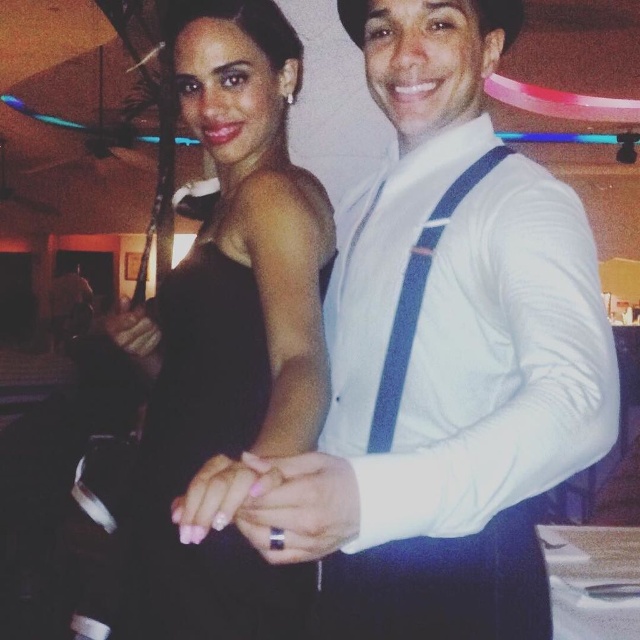
Question: Can you confirm if white satin shirt at center is positioned to the left of black satin dress at center?

Choices:
 (A) yes
 (B) no

Answer: (B)

Question: Does white satin shirt at center appear under black satin dress at center?

Choices:
 (A) no
 (B) yes

Answer: (A)

Question: Among these objects, which one is nearest to the camera?

Choices:
 (A) black satin dress at center
 (B) white satin shirt at center

Answer: (B)

Question: Which point is closer to the camera?

Choices:
 (A) white satin shirt at center
 (B) black satin dress at center

Answer: (A)

Question: Does white satin shirt at center appear on the left side of black satin dress at center?

Choices:
 (A) no
 (B) yes

Answer: (A)